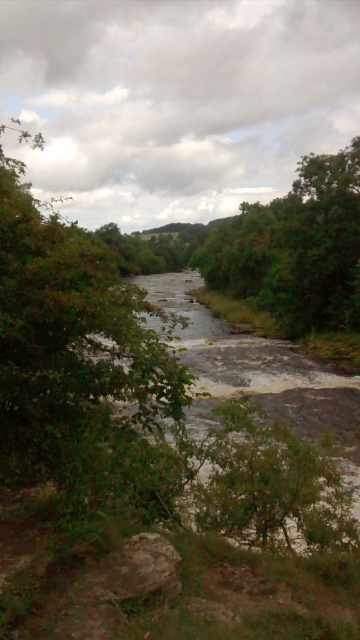
You are standing at the origin point of the coordinate system in the image. Which direction should you move to reach the green leafy tree at left?

The green leafy tree at left is located at coordinate point 0.564 in the x direction and 0.222 in the y direction. Since you are at the origin, you should move towards positive x and positive y directions to reach it.

You are standing at the center of the riverbank and see a point marked at coordinates point (x=250, y=369). What type of terrain feature is located at that exact point?

The terrain feature at point (x=250, y=369) is a rough textured stream at center.

You are standing at the point labeled as point (79, 360) in the scene. What type of object is located at this point?

The point (79, 360) is located on a green leafy tree at left.